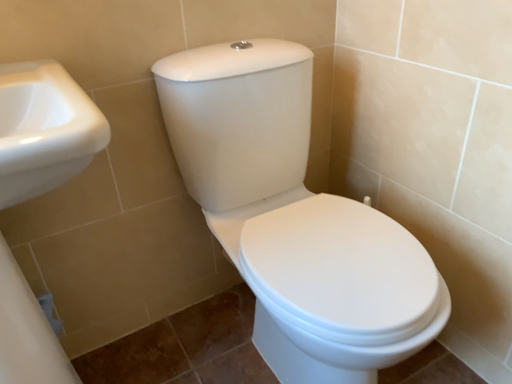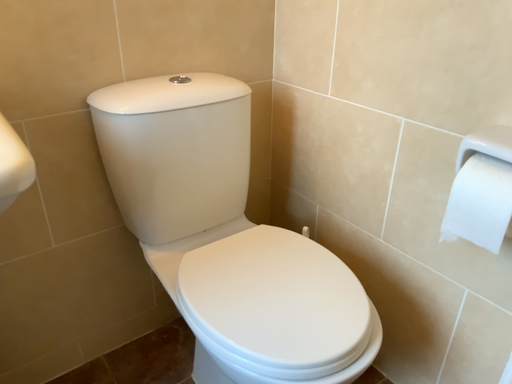
Question: Which way did the camera rotate in the video?

Choices:
 (A) rotated right
 (B) rotated left

Answer: (A)